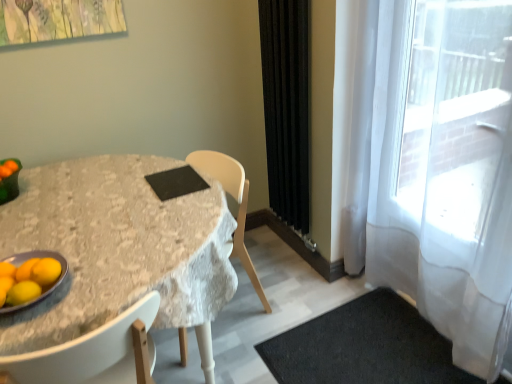
The width and height of the screenshot is (512, 384). I want to click on white sheer curtain at right, the 2th curtain positioned from the left, so click(x=446, y=171).

Measure the distance between point (33, 286) and camera.

Point (33, 286) is 3.73 feet away from camera.

This screenshot has width=512, height=384. What do you see at coordinates (116, 247) in the screenshot?
I see `linen-covered table at center` at bounding box center [116, 247].

The height and width of the screenshot is (384, 512). In order to click on metallic gray platter at lower left in this screenshot , I will do `click(42, 289)`.

The image size is (512, 384). Describe the element at coordinates (42, 289) in the screenshot. I see `metallic gray platter at lower left` at that location.

What do you see at coordinates (364, 347) in the screenshot? I see `black rubber doormat at lower right` at bounding box center [364, 347].

I want to click on black rubber doormat at lower right, so click(364, 347).

The image size is (512, 384). I want to click on white sheer curtain at right, the 2th curtain positioned from the left, so click(446, 171).

Is yellow matte/orange at lower left facing towards orange matte tangerine at lower left?

No, yellow matte/orange at lower left does not turn towards orange matte tangerine at lower left.

Is orange matte tangerine at lower left inside yellow matte/orange at lower left?

No, orange matte tangerine at lower left is not inside yellow matte/orange at lower left.

In the image, is yellow matte/orange at lower left positioned in front of or behind orange matte tangerine at lower left?

In the image, yellow matte/orange at lower left appears in front of orange matte tangerine at lower left.

How many degrees apart are the facing directions of yellow matte/orange at lower left and orange matte tangerine at lower left?

The angle between the facing direction of yellow matte/orange at lower left and the facing direction of orange matte tangerine at lower left is 0.00749 degrees.

Is the surface of yellow matte/orange at lower left in direct contact with metallic gray platter at lower left?

Yes, yellow matte/orange at lower left is beside metallic gray platter at lower left.

From a real-world perspective, is yellow matte/orange at lower left positioned over metallic gray platter at lower left based on gravity?

Yes, from a real-world perspective, yellow matte/orange at lower left is on top of metallic gray platter at lower left.

Is yellow matte/orange at lower left positioned beyond the bounds of metallic gray platter at lower left?

yellow matte/orange at lower left lies outside metallic gray platter at lower left's area.

Considering the positions of objects yellow matte/orange at lower left and metallic gray platter at lower left in the image provided, who is more to the right, yellow matte/orange at lower left or metallic gray platter at lower left?

Positioned to the right is yellow matte/orange at lower left.

Locate an element on the screen. platter located on the left of white sheer curtain at right, the first curtain viewed from the right is located at coordinates (42, 289).

In the image, is metallic gray platter at lower left on the left side or the right side of white sheer curtain at right, the 2th curtain positioned from the left?

In the image, metallic gray platter at lower left appears on the left side of white sheer curtain at right, the 2th curtain positioned from the left.

Is white sheer curtain at right, the 2th curtain positioned from the left, surrounded by metallic gray platter at lower left?

Actually, white sheer curtain at right, the 2th curtain positioned from the left, is outside metallic gray platter at lower left.

From the image's perspective, is metallic gray platter at lower left on white sheer curtain at right, the first curtain viewed from the right?

No, from the image's perspective, metallic gray platter at lower left is not above white sheer curtain at right, the first curtain viewed from the right.

From a real-world perspective, is linen-covered table at center located beneath yellow matte lemon at lower left?

Yes.

Locate an element on the screen. This screenshot has width=512, height=384. table below the yellow matte lemon at lower left (from a real-world perspective) is located at coordinates (116, 247).

Based on the photo, from the image's perspective, between linen-covered table at center and yellow matte lemon at lower left, who is located below?

linen-covered table at center is shown below in the image.

How distant is linen-covered table at center from yellow matte lemon at lower left?

A distance of 49.24 centimeters exists between linen-covered table at center and yellow matte lemon at lower left.

Which object is positioned more to the left, white sheer curtain at right, the first curtain viewed from the right, or yellow matte lemon at lower left?

From the viewer's perspective, yellow matte lemon at lower left appears more on the left side.

Is white sheer curtain at right, the 2th curtain positioned from the left, oriented away from yellow matte lemon at lower left?

No, white sheer curtain at right, the 2th curtain positioned from the left, is not facing away from yellow matte lemon at lower left.

Is white sheer curtain at right, the 2th curtain positioned from the left, in front of yellow matte lemon at lower left?

Yes, it is in front of yellow matte lemon at lower left.

From the image's perspective, which one is positioned lower, white sheer curtain at right, the 2th curtain positioned from the left, or yellow matte lemon at lower left?

yellow matte lemon at lower left is shown below in the image.

The image size is (512, 384). I want to click on tangerine positioned vertically above the black fabric curtain at right, which is the 1th curtain in left-to-right order (from a real-world perspective), so click(x=26, y=270).

Considering the sizes of black fabric curtain at right, arranged as the second curtain when viewed from the right, and orange matte tangerine at lower left in the image, is black fabric curtain at right, arranged as the second curtain when viewed from the right, wider or thinner than orange matte tangerine at lower left?

Clearly, black fabric curtain at right, arranged as the second curtain when viewed from the right, has more width compared to orange matte tangerine at lower left.

Between black fabric curtain at right, arranged as the second curtain when viewed from the right, and orange matte tangerine at lower left, which one has more height?

With more height is black fabric curtain at right, arranged as the second curtain when viewed from the right.

Is yellow matte/orange at lower left oriented away from white sheer curtain at right, the 2th curtain positioned from the left?

No, yellow matte/orange at lower left is not facing the opposite direction of white sheer curtain at right, the 2th curtain positioned from the left.

From the image's perspective, who appears lower, yellow matte/orange at lower left or white sheer curtain at right, the first curtain viewed from the right?

yellow matte/orange at lower left, from the image's perspective.

Is yellow matte/orange at lower left touching white sheer curtain at right, the first curtain viewed from the right?

yellow matte/orange at lower left and white sheer curtain at right, the first curtain viewed from the right, are clearly separated.

I want to click on tangerine lying behind the yellow matte/orange at lower left, so click(26, 270).

Find the location of `platter located on the left of yellow matte/orange at lower left`. platter located on the left of yellow matte/orange at lower left is located at coordinates (42, 289).

When comparing their distances from black fabric curtain at right, which is the 1th curtain in left-to-right order, does white sheer curtain at right, the first curtain viewed from the right, or yellow matte/orange at lower left seem closer?

white sheer curtain at right, the first curtain viewed from the right.

Which object lies further to the anchor point metallic gray platter at lower left, yellow matte lemon at lower left or black fabric curtain at right, arranged as the second curtain when viewed from the right?

Based on the image, black fabric curtain at right, arranged as the second curtain when viewed from the right, appears to be further to metallic gray platter at lower left.

Which object lies nearer to the anchor point white sheer curtain at right, the 2th curtain positioned from the left, yellow matte/orange at lower left or metallic gray platter at lower left?

metallic gray platter at lower left lies closer to white sheer curtain at right, the 2th curtain positioned from the left, than the other object.

Looking at the image, which one is located closer to yellow matte/orange at lower left, yellow matte lemon at lower left or white sheer curtain at right, the first curtain viewed from the right?

yellow matte lemon at lower left is positioned closer to the anchor yellow matte/orange at lower left.

Looking at the image, which one is located further to black fabric curtain at right, arranged as the second curtain when viewed from the right, white sheer curtain at right, the first curtain viewed from the right, or linen-covered table at center?

Based on the image, linen-covered table at center appears to be further to black fabric curtain at right, arranged as the second curtain when viewed from the right.

From the image, which object appears to be farther from linen-covered table at center, yellow matte/orange at lower left or yellow matte lemon at lower left?

The object further to linen-covered table at center is yellow matte lemon at lower left.

Considering their positions, is white sheer curtain at right, the 2th curtain positioned from the left, positioned closer to orange matte tangerine at lower left than yellow matte/orange at lower left?

yellow matte/orange at lower left lies closer to orange matte tangerine at lower left than the other object.

From the image, which object appears to be farther from yellow matte/orange at lower left, black rubber doormat at lower right or white sheer curtain at right, the first curtain viewed from the right?

white sheer curtain at right, the first curtain viewed from the right.

You are a GUI agent. You are given a task and a screenshot of the screen. Output one action in this format:
    pyautogui.click(x=<x>, y=<y>)
    Task: Click on the lemon between orange matte tangerine at lower left and white sheer curtain at right, the 2th curtain positioned from the left, in the horizontal direction
    This screenshot has height=384, width=512.
    Given the screenshot: What is the action you would take?
    pyautogui.click(x=23, y=292)

The width and height of the screenshot is (512, 384). Identify the location of lemon between metallic gray platter at lower left and black fabric curtain at right, which is the 1th curtain in left-to-right order. (23, 292).

Where is `platter between linen-covered table at center and yellow matte/orange at lower left along the z-axis`? platter between linen-covered table at center and yellow matte/orange at lower left along the z-axis is located at coordinates (42, 289).

The image size is (512, 384). I want to click on orange between linen-covered table at center and black fabric curtain at right, arranged as the second curtain when viewed from the right, from left to right, so (x=46, y=271).